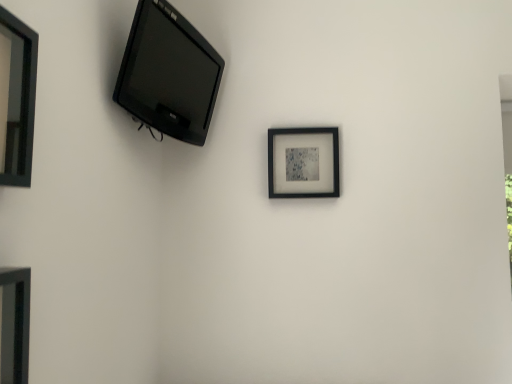
Question: Is black glossy picture frame at upper left, which appears as the first picture frame when viewed from the left, in front of or behind matte black picture frame at lower left, positioned as the third picture frame in back-to-front order, in the image?

Choices:
 (A) front
 (B) behind

Answer: (B)

Question: Visually, is black glossy picture frame at upper left, which appears as the 2th picture frame when viewed from the back, positioned to the left or to the right of matte black picture frame at lower left, marked as the 2th picture frame in a left-to-right arrangement?

Choices:
 (A) right
 (B) left

Answer: (B)

Question: Which of these objects is positioned farthest from the matte black picture frame at lower left, which appears as the second picture frame when viewed from the right?

Choices:
 (A) matte black tv at upper left
 (B) black matte picture frame at center, the 1th picture frame when ordered from right to left
 (C) black glossy picture frame at upper left, marked as the 3th picture frame in a right-to-left arrangement

Answer: (B)

Question: Estimate the real-world distances between objects in this image. Which object is farther from the matte black picture frame at lower left, marked as the 2th picture frame in a left-to-right arrangement?

Choices:
 (A) matte black tv at upper left
 (B) black matte picture frame at center, the 1th picture frame when ordered from right to left
 (C) black glossy picture frame at upper left, which appears as the 2th picture frame when viewed from the back

Answer: (B)